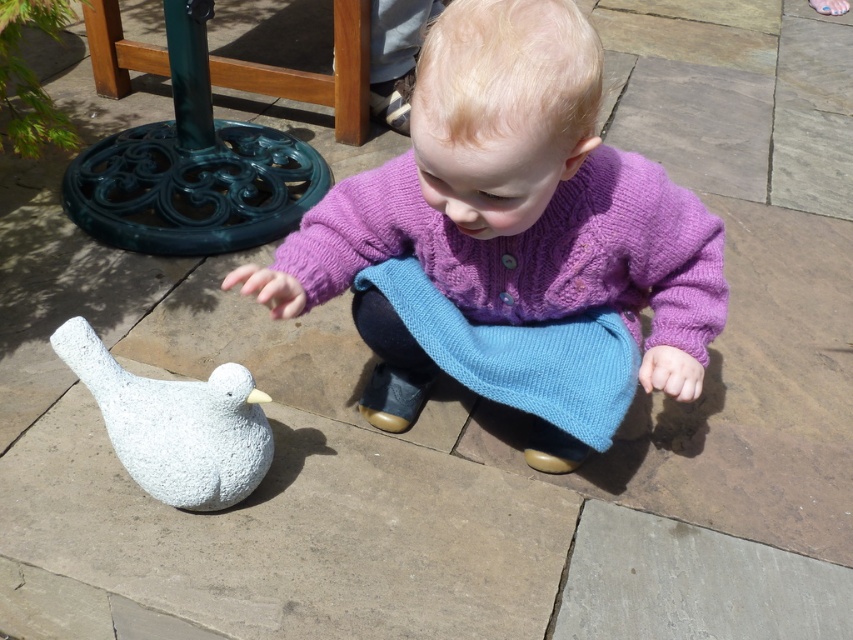
The child is wearing a purple knitted sweater at center and there is a white textured bird at lower left in the scene. Which object is positioned higher relative to the other?

The purple knitted sweater at center is located above the white textured bird at lower left, so the purple knitted sweater at center is higher.

You are a photographer taking a picture of the purple knitted sweater at center and the white textured bird at lower left. Based on their positions, which object should you focus on first to ensure both are in the frame?

The purple knitted sweater at center is in front of the white textured bird at lower left, so you should focus on the purple knitted sweater at center first to ensure both are in the frame.